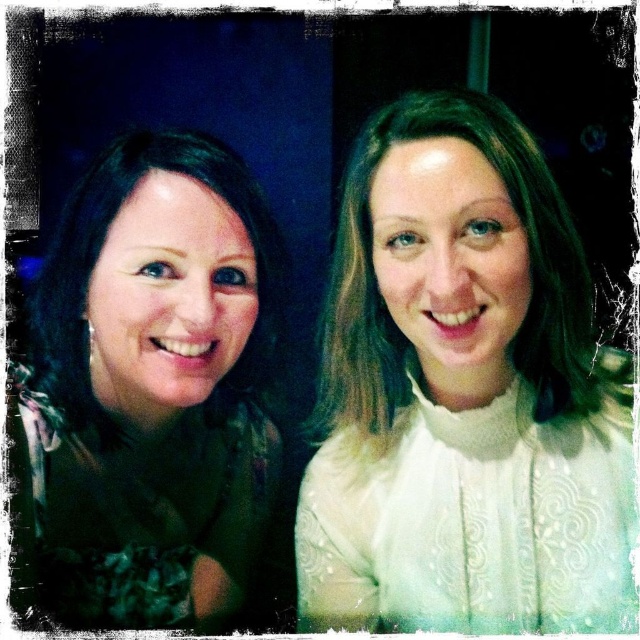
Does point (560, 202) lie behind point (188, 173)?

No.

Can you confirm if white lace blouse at right is thinner than matte green dress at left?

In fact, white lace blouse at right might be wider than matte green dress at left.

Find the location of a particular element. The height and width of the screenshot is (640, 640). white lace blouse at right is located at coordinates (465, 394).